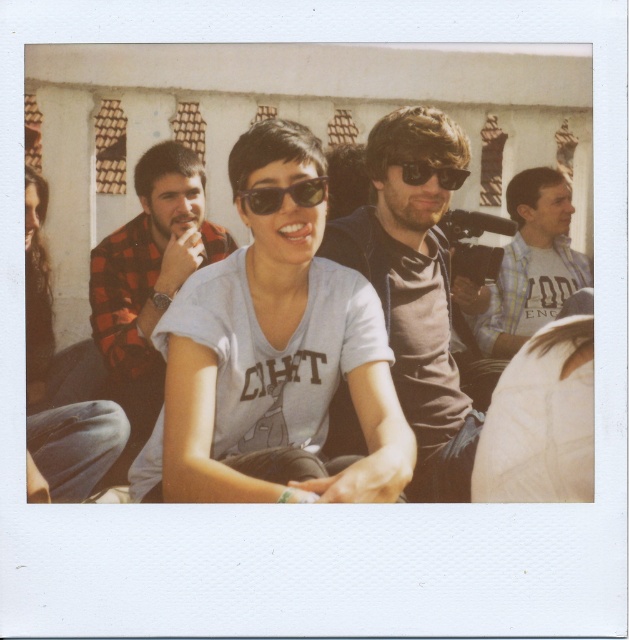
You are standing in front of the Polaroid photo and want to determine which of the two points, point (x=309, y=188) or point (x=411, y=161), is nearer to you. Based on the image, which point is closer?

Point (x=309, y=188) is closer to the camera than point (x=411, y=161), so the point closer to you is point (x=309, y=188).

You are analyzing the layout of the Polaroid photograph. The scene includes a woman in a light gray t shirt with CIHT printed on it, someone in a red and black checkered shirt, and a man holding a camera. Where is the matte brown shirt at center positioned relative to the other figures?

The matte brown shirt at center is located at point (415, 291), which places it centrally in the image coordinates, making it the focal point among the other figures.